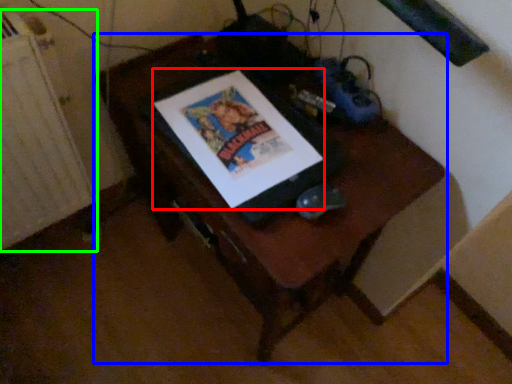
Question: Which is nearer to the comic book (highlighted by a red box)? furniture (highlighted by a blue box) or radiator (highlighted by a green box).

Choices:
 (A) furniture
 (B) radiator

Answer: (A)